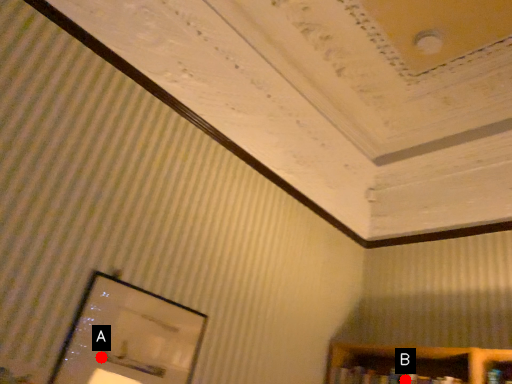
Question: Two points are circled on the image, labeled by A and B beside each circle. Which point is closer to the camera?

Choices:
 (A) A is closer
 (B) B is closer

Answer: (A)